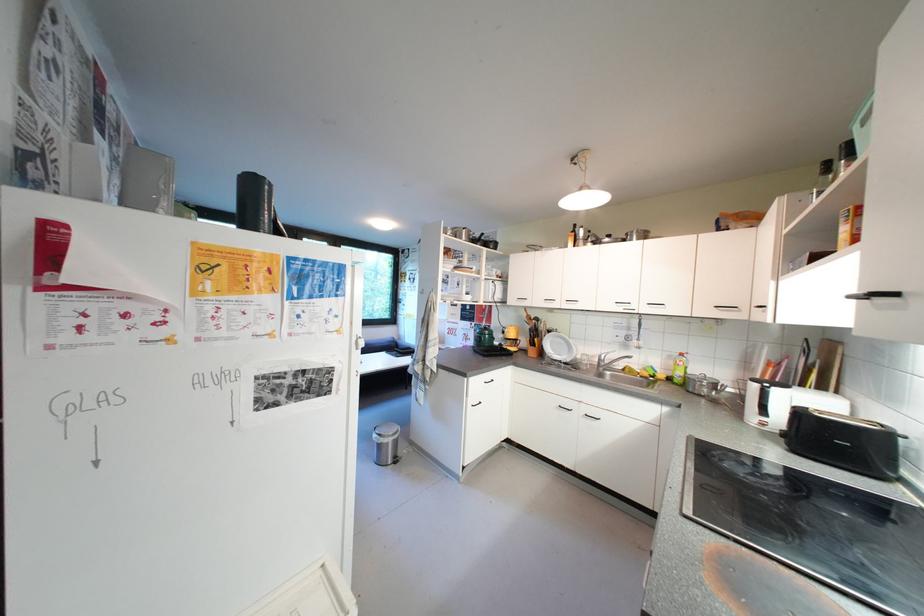
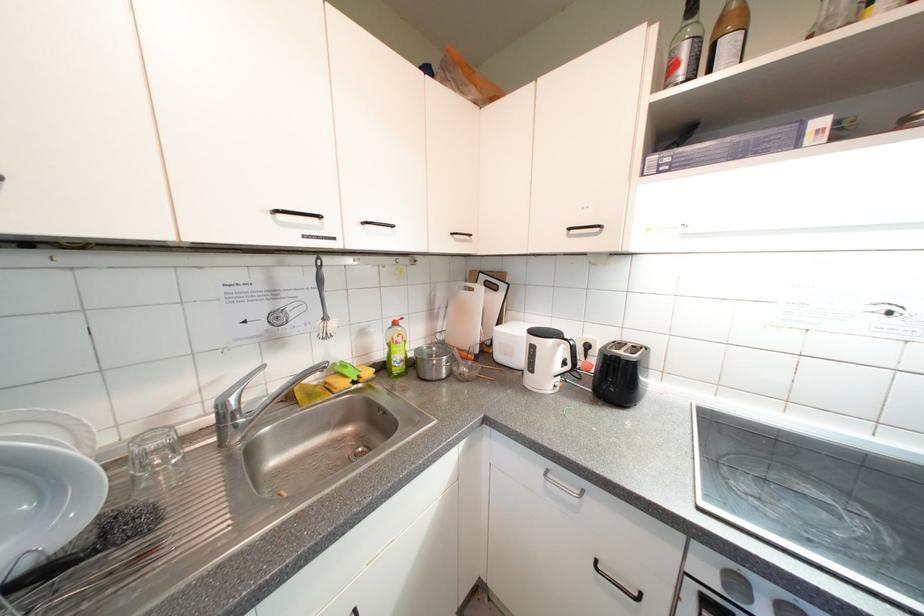
The point at (x=687, y=376) is marked in the first image. Where is the corresponding point in the second image?

(406, 358)